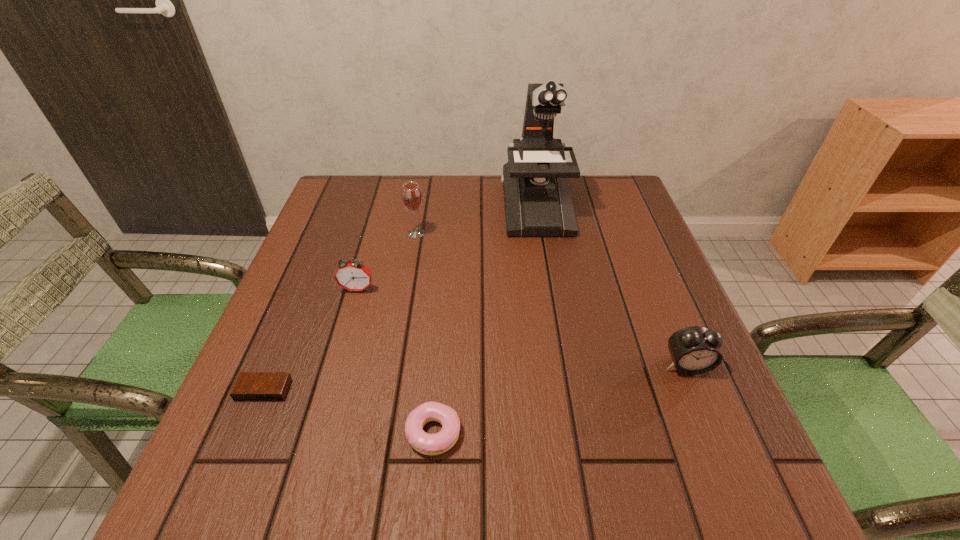
Locate an element on the screen. This screenshot has width=960, height=540. the leftmost object is located at coordinates (250, 386).

Find the location of a particular element. This screenshot has width=960, height=540. the shortest object is located at coordinates (250, 386).

Where is `vacant space located 0.130m through the eyepieces of the microscope`? vacant space located 0.130m through the eyepieces of the microscope is located at coordinates (546, 271).

Where is `free space located 0.170m on the front of the fourth object from right to left`? free space located 0.170m on the front of the fourth object from right to left is located at coordinates (407, 286).

I want to click on vacant space located 0.150m on the front side of the rightmost alarm clock, so click(x=723, y=455).

You are a GUI agent. You are given a task and a screenshot of the screen. Output one action in this format:
    pyautogui.click(x=<x>, y=<y>)
    Task: Click on the vacant area situated on the clock face of the second alarm clock from left to right
    Image resolution: width=960 pixels, height=540 pixels.
    Given the screenshot: What is the action you would take?
    pyautogui.click(x=338, y=355)

Identify the location of free location located 0.150m on the back of the fifth tallest object. This screenshot has width=960, height=540. (441, 342).

You are a GUI agent. You are given a task and a screenshot of the screen. Output one action in this format:
    pyautogui.click(x=<x>, y=<y>)
    Task: Click on the blank space located 0.050m on the front face of the second nearest object
    The height and width of the screenshot is (540, 960).
    Given the screenshot: What is the action you would take?
    pyautogui.click(x=249, y=427)

I want to click on object that is positioned at the far edge, so click(x=537, y=198).

The width and height of the screenshot is (960, 540). Identify the location of object positioned at the near edge. (428, 444).